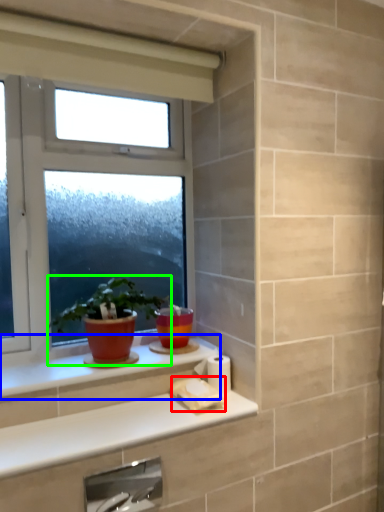
Question: Which object is the farthest from toilet paper (highlighted by a red box)? Choose among these: window sill (highlighted by a blue box) or houseplant (highlighted by a green box).

Choices:
 (A) window sill
 (B) houseplant

Answer: (B)